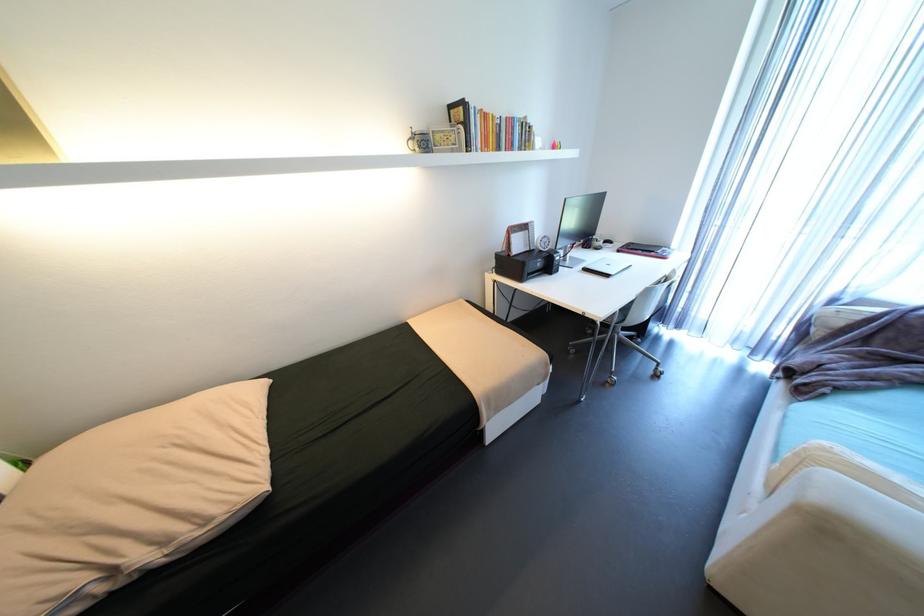
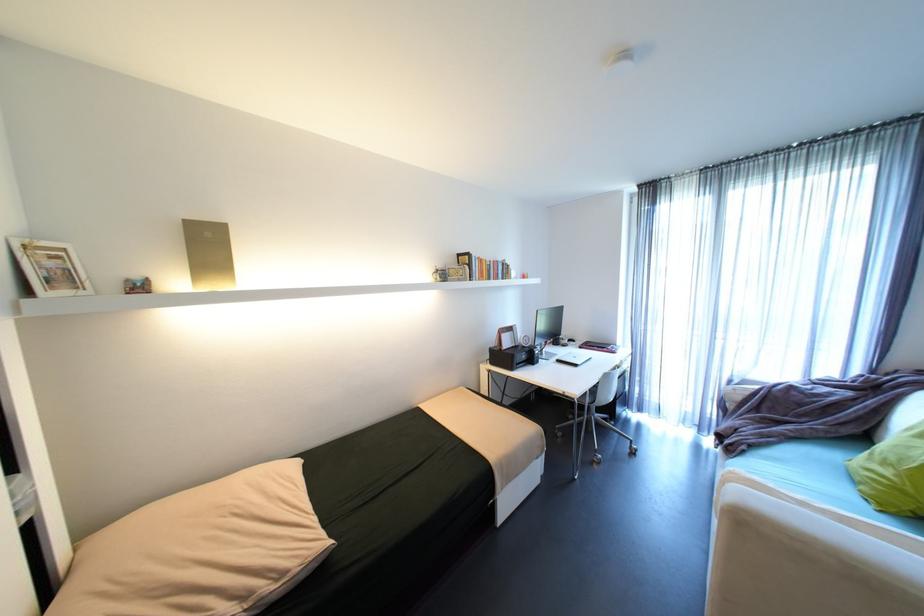
The point at (514, 118) is marked in the first image. Where is the corresponding point in the second image?

(500, 262)